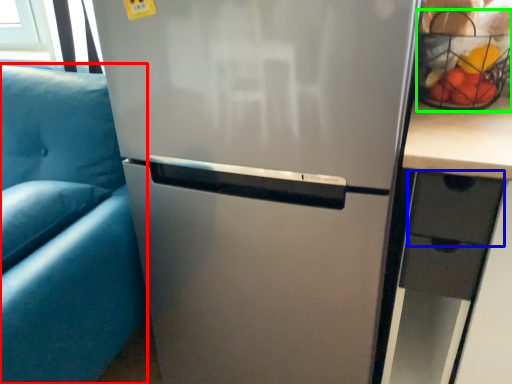
Question: Based on their relative distances, which object is farther from armchair (highlighted by a red box)? Choose from drawer (highlighted by a blue box) and basket (highlighted by a green box).

Choices:
 (A) drawer
 (B) basket

Answer: (B)